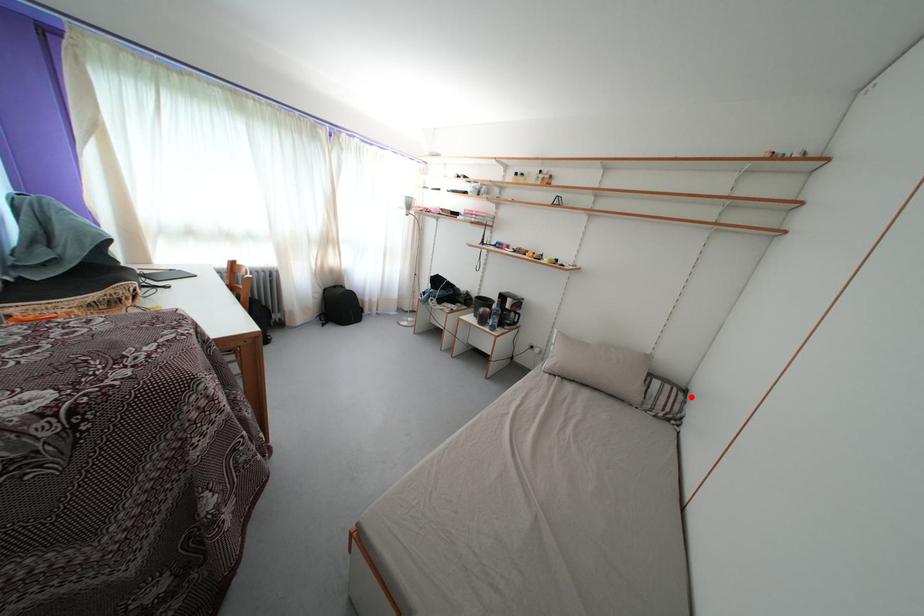
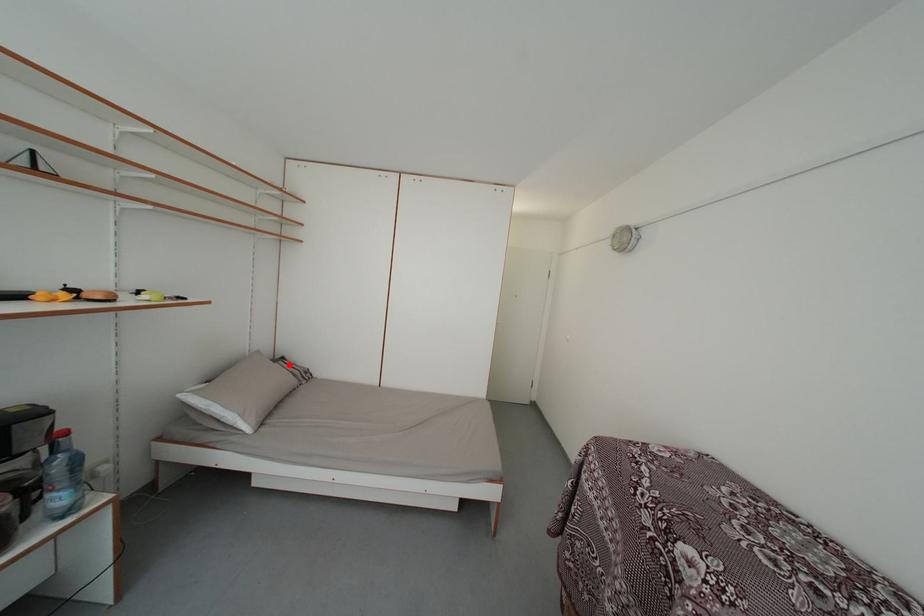
I am providing you with two images of the same scene from different viewpoints. A red point is marked on the first image and another point is marked on the second image. Is the marked point in image1 the same physical position as the marked point in image2?

Yes